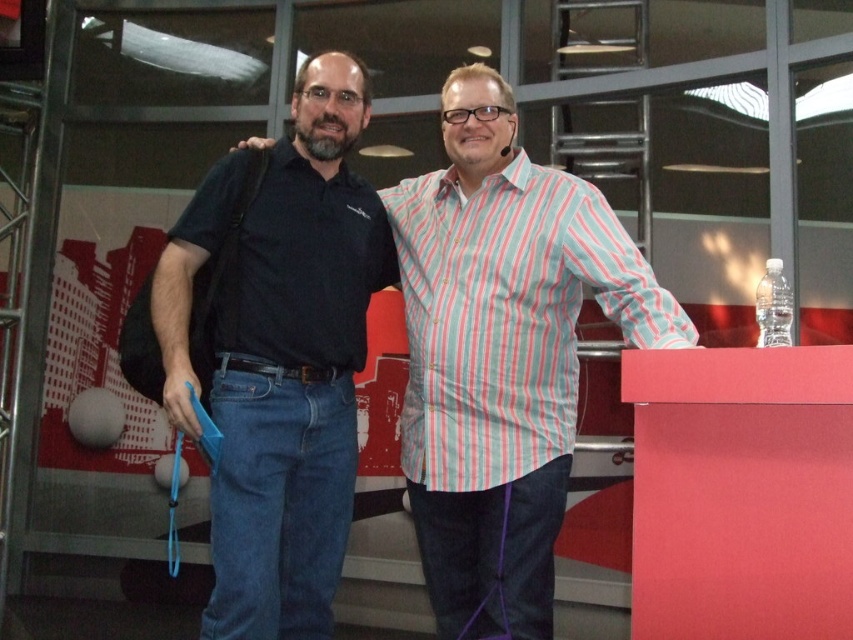
You are organizing a photo shoot and need to ensure that the two people in the image are wearing shirts of the same width. The individuals are wearing a matte black shirt at center and a black matte shirt at center. Based on the description, can both shirts be considered the same in width?

The matte black shirt at center is wider than the black matte shirt at center, so they cannot be considered the same in width.